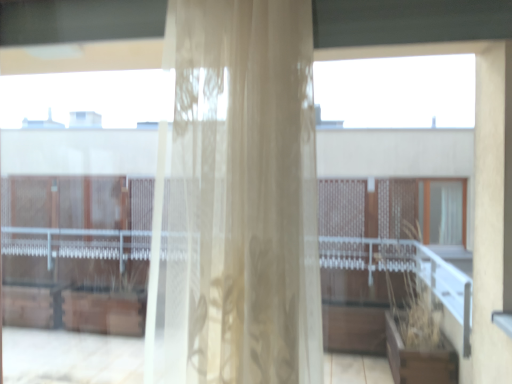
Question: Considering the positions of translucent floral-patterned curtain at center and transparent glass window at upper right in the image, is translucent floral-patterned curtain at center taller or shorter than transparent glass window at upper right?

Choices:
 (A) short
 (B) tall

Answer: (B)

Question: Is translucent floral-patterned curtain at center bigger or smaller than transparent glass window at upper right?

Choices:
 (A) big
 (B) small

Answer: (A)

Question: Considering the positions of translucent floral-patterned curtain at center and transparent glass window at upper right in the image, is translucent floral-patterned curtain at center wider or thinner than transparent glass window at upper right?

Choices:
 (A) thin
 (B) wide

Answer: (B)

Question: Does point (403, 140) appear closer or farther from the camera than point (184, 132)?

Choices:
 (A) farther
 (B) closer

Answer: (A)

Question: From a real-world perspective, is transparent glass window at upper right positioned above or below translucent floral-patterned curtain at center?

Choices:
 (A) below
 (B) above

Answer: (A)

Question: Based on their sizes in the image, would you say transparent glass window at upper right is bigger or smaller than translucent floral-patterned curtain at center?

Choices:
 (A) small
 (B) big

Answer: (A)

Question: In terms of width, does transparent glass window at upper right look wider or thinner when compared to translucent floral-patterned curtain at center?

Choices:
 (A) thin
 (B) wide

Answer: (A)